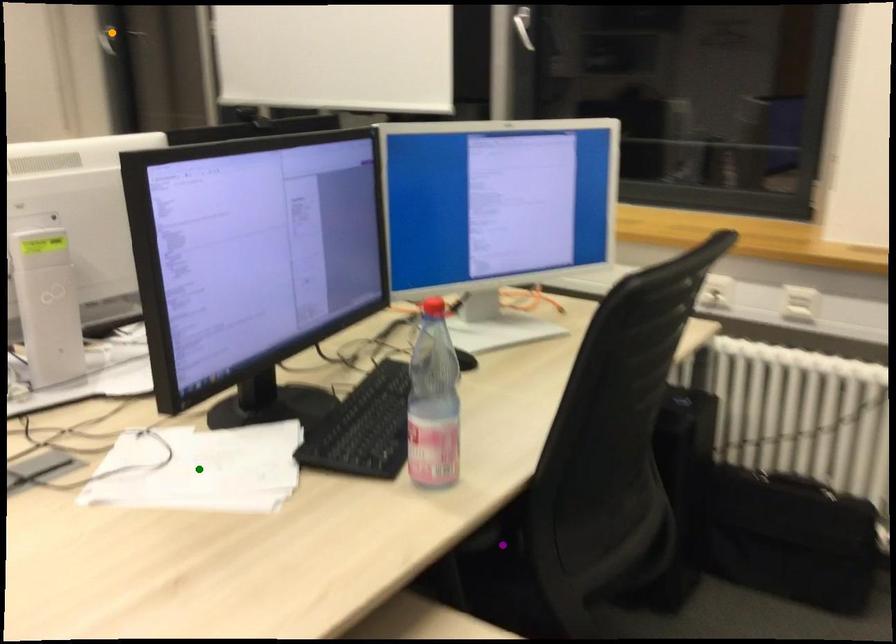
Order these from nearest to farthest:
orange point | purple point | green point

1. purple point
2. green point
3. orange point